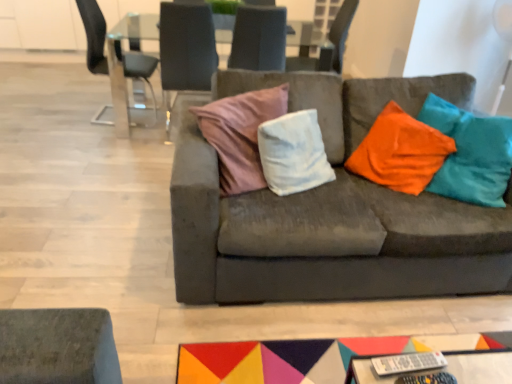
Question: Considering the relative sizes of transparent glass table at upper center and suede-like gray chair at upper center, the 2th chair viewed from the right, in the image provided, is transparent glass table at upper center shorter than suede-like gray chair at upper center, the 2th chair viewed from the right,?

Choices:
 (A) no
 (B) yes

Answer: (A)

Question: Would you say transparent glass table at upper center is outside suede-like gray chair at upper center, placed as the third chair when sorted from left to right?

Choices:
 (A) yes
 (B) no

Answer: (A)

Question: Is transparent glass table at upper center next to suede-like gray chair at upper center, the 2th chair viewed from the right, and touching it?

Choices:
 (A) no
 (B) yes

Answer: (A)

Question: Is transparent glass table at upper center smaller than suede-like gray chair at upper center, placed as the third chair when sorted from left to right?

Choices:
 (A) no
 (B) yes

Answer: (A)

Question: Does transparent glass table at upper center have a lesser width compared to suede-like gray chair at upper center, placed as the third chair when sorted from left to right?

Choices:
 (A) no
 (B) yes

Answer: (A)

Question: Is transparent glass table at upper center facing towards suede-like gray chair at upper center, placed as the third chair when sorted from left to right?

Choices:
 (A) no
 (B) yes

Answer: (A)

Question: Does transparent glass table at upper center have a smaller size compared to suede couch at center?

Choices:
 (A) yes
 (B) no

Answer: (A)

Question: Is the position of transparent glass table at upper center more distant than that of suede couch at center?

Choices:
 (A) no
 (B) yes

Answer: (B)

Question: Is the position of transparent glass table at upper center less distant than that of suede couch at center?

Choices:
 (A) no
 (B) yes

Answer: (A)

Question: Would you say transparent glass table at upper center is a long distance from suede couch at center?

Choices:
 (A) no
 (B) yes

Answer: (B)

Question: From the image's perspective, is transparent glass table at upper center over suede couch at center?

Choices:
 (A) no
 (B) yes

Answer: (B)

Question: Is suede couch at center at the back of transparent glass table at upper center?

Choices:
 (A) yes
 (B) no

Answer: (B)

Question: Is metallic glass chair at upper left, the first chair from the left, closer to camera compared to velvet cushion at center, the third chair when ordered from right to left?

Choices:
 (A) no
 (B) yes

Answer: (A)